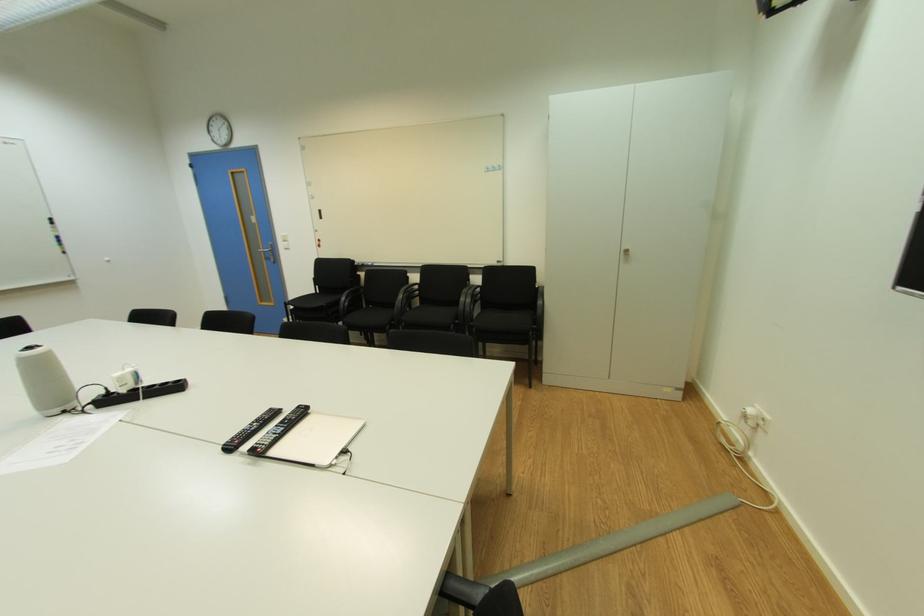
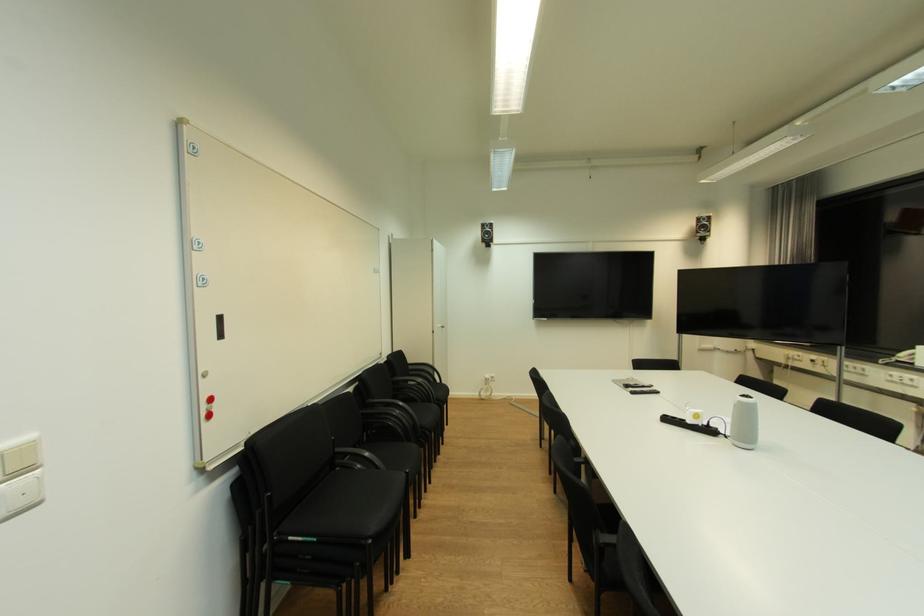
Locate, in the second image, the point that corresponds to point (180, 387) in the first image.

(674, 421)